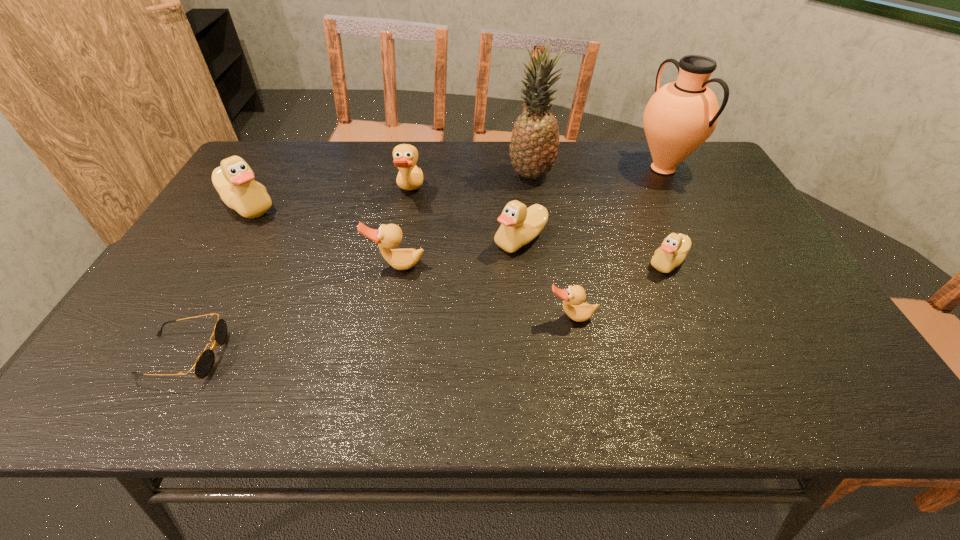
At what (x,y) coordinates should I click in order to perform the action: click on duck located in the left edge section of the desktop. Please return your answer as a coordinate pair (x, y). Looking at the image, I should click on (234, 180).

Image resolution: width=960 pixels, height=540 pixels. In order to click on sunglasses that is at the left edge in this screenshot , I will do `click(204, 364)`.

Image resolution: width=960 pixels, height=540 pixels. In order to click on object that is positioned at the right edge in this screenshot , I will do `click(680, 116)`.

Where is `object that is at the near left corner`? The height and width of the screenshot is (540, 960). object that is at the near left corner is located at coordinates (204, 364).

In order to click on object that is at the far right corner in this screenshot , I will do `click(680, 116)`.

The image size is (960, 540). In the image, there is a desktop. Find the location of `free space at the far edge`. free space at the far edge is located at coordinates (365, 171).

At what (x,y) coordinates should I click in order to perform the action: click on vacant space at the near edge of the desktop. Please return your answer as a coordinate pair (x, y). Image resolution: width=960 pixels, height=540 pixels. Looking at the image, I should click on (578, 380).

Identify the location of free location at the left edge. (243, 234).

This screenshot has width=960, height=540. Find the location of `vacant region at the right edge of the desktop`. vacant region at the right edge of the desktop is located at coordinates (769, 312).

This screenshot has height=540, width=960. In order to click on vacant space at the far left corner in this screenshot , I will do `click(245, 160)`.